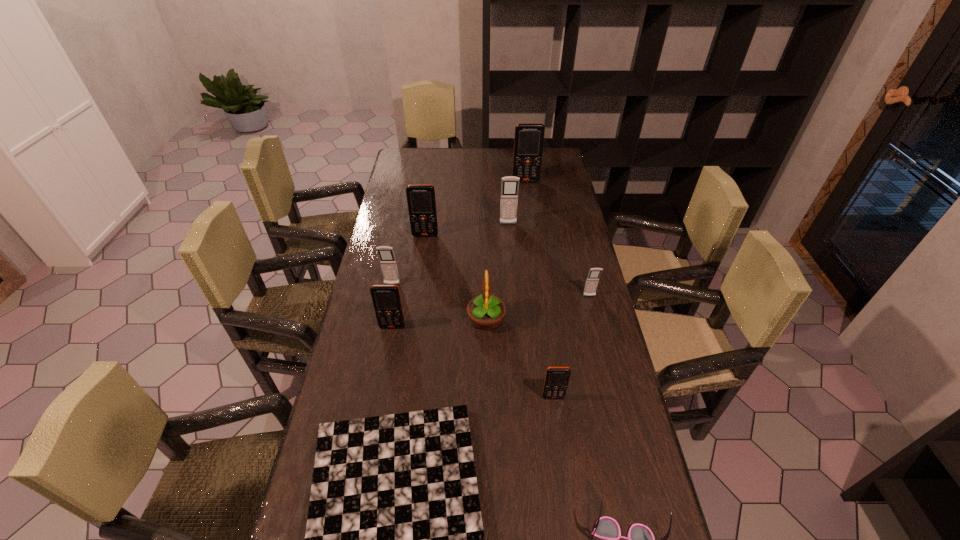
Identify which orange cellular telephone is the nearest to the yellow sunflower. Please provide its 2D coordinates. Your answer should be formatted as a tuple, i.e. [(x, y)], where the tuple contains the x and y coordinates of a point satisfying the conditions above.

[(386, 299)]

Identify which gray cellular telephone is the third closest to the second shortest object. Please provide its 2D coordinates. Your answer should be formatted as a tuple, i.e. [(x, y)], where the tuple contains the x and y coordinates of a point satisfying the conditions above.

[(510, 184)]

Identify which gray cellular telephone is the closest to the farthest gray cellular telephone. Please provide its 2D coordinates. Your answer should be formatted as a tuple, i.e. [(x, y)], where the tuple contains the x and y coordinates of a point satisfying the conditions above.

[(592, 280)]

Where is `vacant region that satisfies the following two spatial constraints: 1. on the front-facing side of the fifth farthest cellular telephone; 2. on the face of the yellow sunflower`? vacant region that satisfies the following two spatial constraints: 1. on the front-facing side of the fifth farthest cellular telephone; 2. on the face of the yellow sunflower is located at coordinates (595, 319).